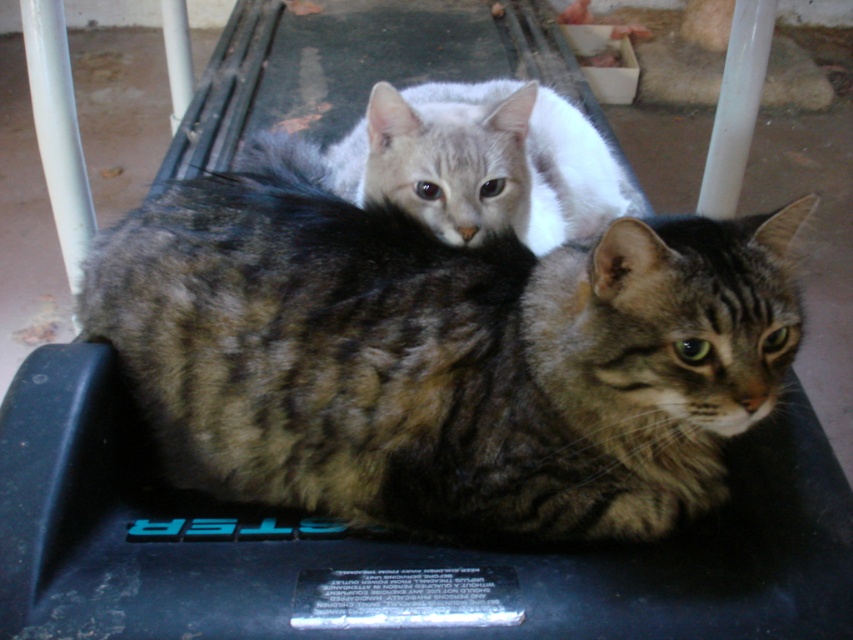
Between point (300, 221) and point (473, 108), which one is positioned in front?

Positioned in front is point (300, 221).

What do you see at coordinates (440, 355) in the screenshot?
I see `tabby fur cat at center` at bounding box center [440, 355].

You are a GUI agent. You are given a task and a screenshot of the screen. Output one action in this format:
    pyautogui.click(x=<x>, y=<y>)
    Task: Click on the tabby fur cat at center
    
    Given the screenshot: What is the action you would take?
    (x=440, y=355)